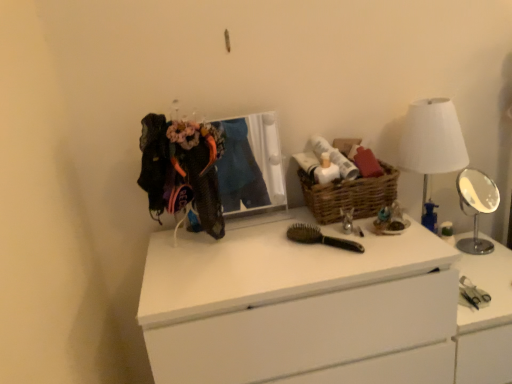
You are a GUI agent. You are given a task and a screenshot of the screen. Output one action in this format:
    pyautogui.click(x=<x>, y=<y>)
    Task: Click on the free space in front of silver metallic mirror at right
    
    Given the screenshot: What is the action you would take?
    pyautogui.click(x=490, y=269)